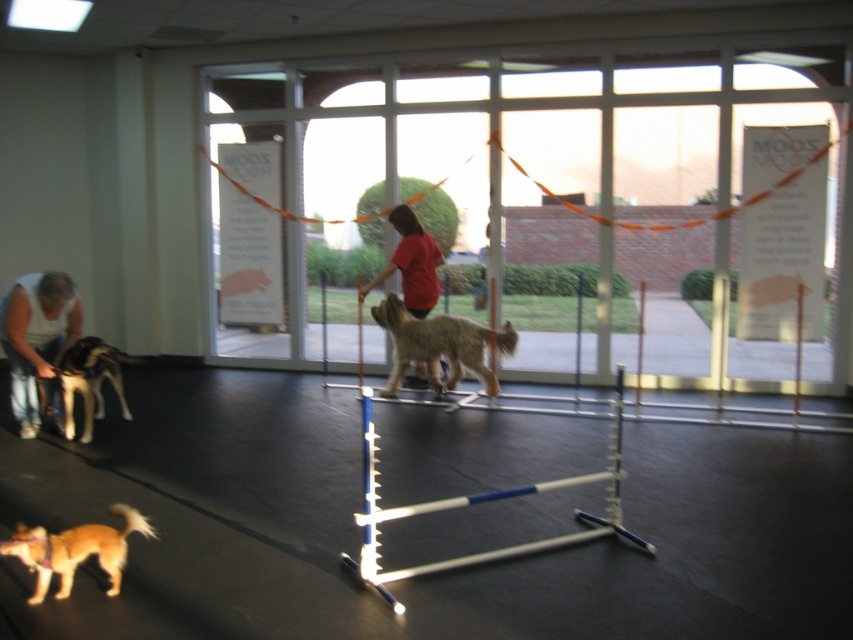
Who is higher up, transparent glass door at center or light brown fur at left?

transparent glass door at center is above.

Is transparent glass door at center closer to the viewer compared to light brown fur at left?

No.

What do you see at coordinates (607, 193) in the screenshot? I see `transparent glass door at center` at bounding box center [607, 193].

At what (x,y) coordinates should I click in order to perform the action: click on transparent glass door at center. Please return your answer as a coordinate pair (x, y). The width and height of the screenshot is (853, 640). Looking at the image, I should click on (607, 193).

Is fuzzy brown dog at center to the left of light brown fur at left from the viewer's perspective?

No, fuzzy brown dog at center is not to the left of light brown fur at left.

Does point (437, 340) come farther from viewer compared to point (67, 408)?

That is True.

You are a GUI agent. You are given a task and a screenshot of the screen. Output one action in this format:
    pyautogui.click(x=<x>, y=<y>)
    Task: Click on the fuzzy brown dog at center
    This screenshot has height=640, width=853.
    Given the screenshot: What is the action you would take?
    pyautogui.click(x=439, y=346)

This screenshot has width=853, height=640. What do you see at coordinates (38, 339) in the screenshot?
I see `white tank top at lower left` at bounding box center [38, 339].

Image resolution: width=853 pixels, height=640 pixels. Describe the element at coordinates (38, 339) in the screenshot. I see `white tank top at lower left` at that location.

This screenshot has width=853, height=640. Identify the location of white tank top at lower left. (38, 339).